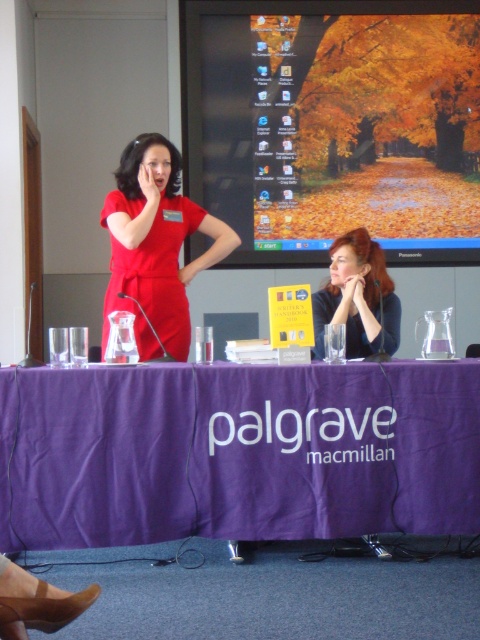
Between purple fabric table at center and autumn leaves wallpaper at upper center, which one has more height?

Standing taller between the two is autumn leaves wallpaper at upper center.

Between purple fabric table at center and autumn leaves wallpaper at upper center, which one appears on the right side from the viewer's perspective?

From the viewer's perspective, autumn leaves wallpaper at upper center appears more on the right side.

Between point (69, 538) and point (477, 20), which one is positioned behind?

Point (477, 20)

Where is `purple fabric table at center`? This screenshot has width=480, height=640. purple fabric table at center is located at coordinates (237, 452).

Who is positioned more to the left, purple fabric table at center or smooth red hair at center?

purple fabric table at center

The height and width of the screenshot is (640, 480). What are the coordinates of `purple fabric table at center` in the screenshot? It's located at (237, 452).

Locate an element on the screen. autumn leaves wallpaper at upper center is located at coordinates (334, 124).

Between autumn leaves wallpaper at upper center and smooth red hair at center, which one is positioned lower?

smooth red hair at center is below.

Is point (317, 225) positioned behind point (315, 353)?

That is True.

The image size is (480, 640). Identify the location of autumn leaves wallpaper at upper center. (334, 124).